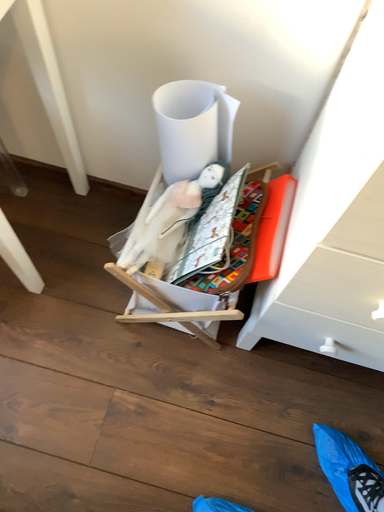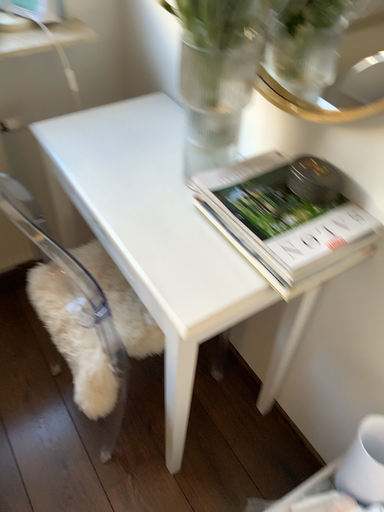
Question: Which way did the camera rotate in the video?

Choices:
 (A) rotated left
 (B) rotated right

Answer: (A)